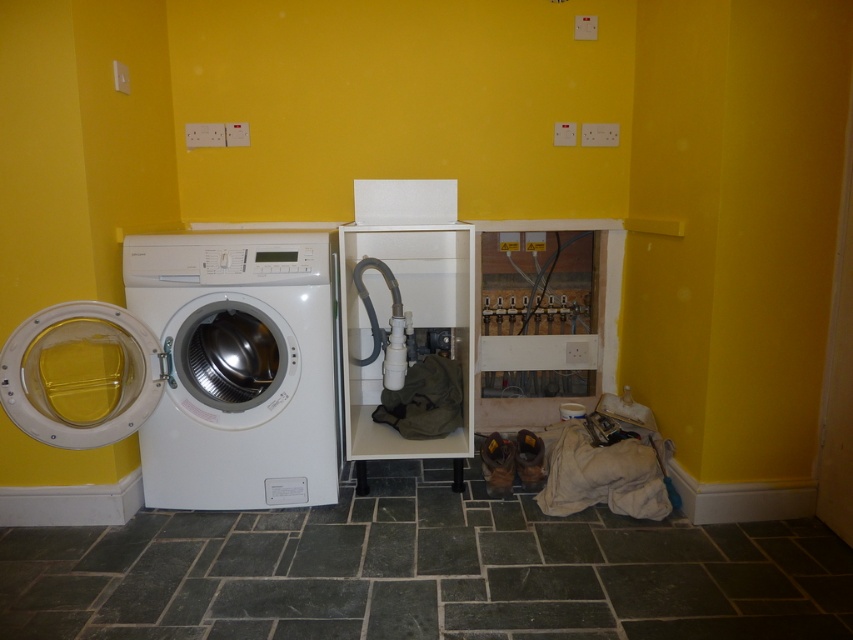
You are organizing the utility room and need to place the white glossy cabinet at center and the green fabric laundry at center side by side. Which object should you place first to ensure they fit properly?

The white glossy cabinet at center is wider than the green fabric laundry at center. Therefore, you should place the white glossy cabinet at center first to accommodate its larger width.

You are organizing laundry in the utility room. You need to place a new laundry basket between the beige fabric laundry at lower right and the green fabric laundry at center. Can you fit it there?

The beige fabric laundry at lower right is to the right of the green fabric laundry at center, so there is space between them where you can place the laundry basket.